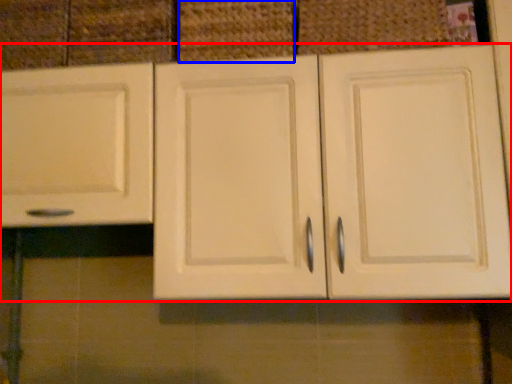
Question: Which object appears closest to the camera in this image, cabinetry (highlighted by a red box) or basket (highlighted by a blue box)?

Choices:
 (A) cabinetry
 (B) basket

Answer: (A)